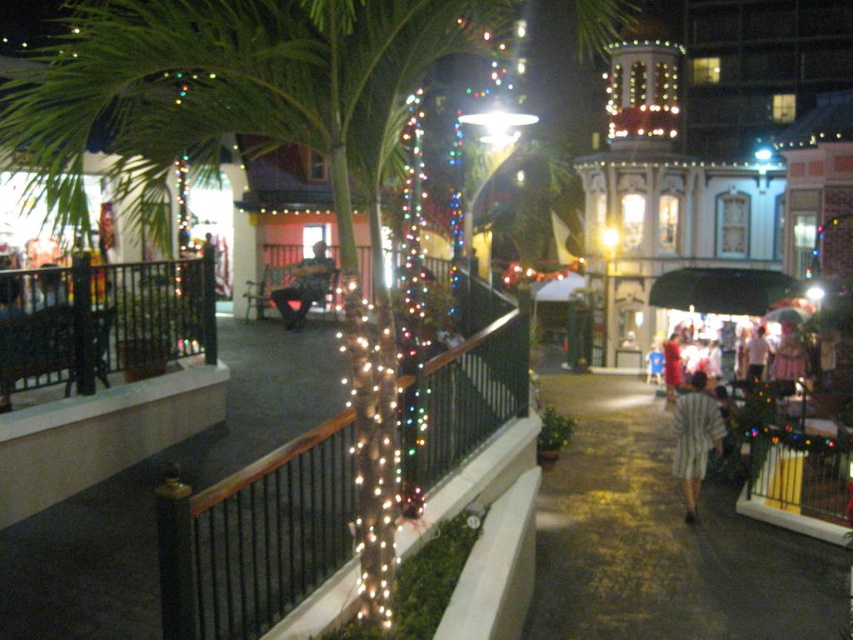
Question: Which of the following is the farthest from the observer?

Choices:
 (A) (606, 589)
 (B) (302, 301)
 (C) (689, 396)

Answer: (B)

Question: Is dark blue jeans at center wider than white cotton shirt at center?

Choices:
 (A) yes
 (B) no

Answer: (B)

Question: Which of the following is the closest to the observer?

Choices:
 (A) (814, 557)
 (B) (206, 564)

Answer: (B)

Question: Which of the following is the farthest from the observer?

Choices:
 (A) (705, 442)
 (B) (747, 380)
 (C) (776, 38)

Answer: (C)

Question: Is white glossy building at center positioned before dark asphalt pavement at lower center?

Choices:
 (A) no
 (B) yes

Answer: (A)

Question: Can you confirm if illuminated wire mesh at upper center is positioned to the right of white cotton shirt at center?

Choices:
 (A) yes
 (B) no

Answer: (B)